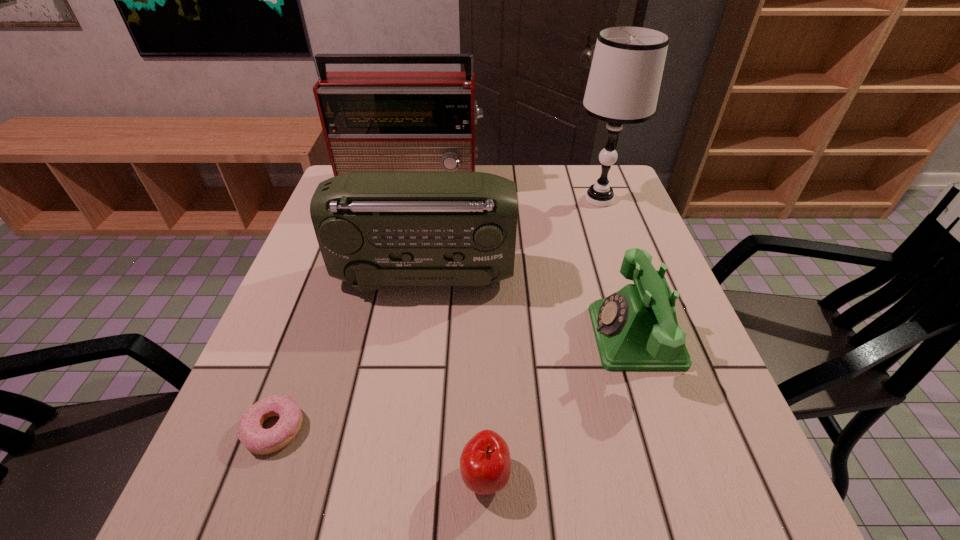
Locate an element on the screen. The width and height of the screenshot is (960, 540). table lamp located in the right edge section of the desktop is located at coordinates (624, 81).

Where is `telephone that is at the right edge`? The width and height of the screenshot is (960, 540). telephone that is at the right edge is located at coordinates (636, 329).

Locate an element on the screen. The width and height of the screenshot is (960, 540). object situated at the far left corner is located at coordinates (372, 121).

Locate an element on the screen. Image resolution: width=960 pixels, height=540 pixels. object that is positioned at the far right corner is located at coordinates (624, 81).

Locate an element on the screen. The height and width of the screenshot is (540, 960). vacant area at the far edge of the desktop is located at coordinates (515, 176).

Locate an element on the screen. The image size is (960, 540). vacant area at the near edge of the desktop is located at coordinates (430, 476).

In the image, there is a desktop. At what (x,y) coordinates should I click in order to perform the action: click on vacant space at the left edge. Please return your answer as a coordinate pair (x, y). This screenshot has height=540, width=960. Looking at the image, I should click on (266, 426).

You are a GUI agent. You are given a task and a screenshot of the screen. Output one action in this format:
    pyautogui.click(x=<x>, y=<y>)
    Task: Click on the vacant space at the right edge
    Image resolution: width=960 pixels, height=540 pixels.
    Given the screenshot: What is the action you would take?
    pyautogui.click(x=684, y=461)

Locate an element on the screen. The image size is (960, 540). free space at the near left corner is located at coordinates (200, 479).

In the image, there is a desktop. What are the coordinates of `vacant space at the far right corner` in the screenshot? It's located at (616, 191).